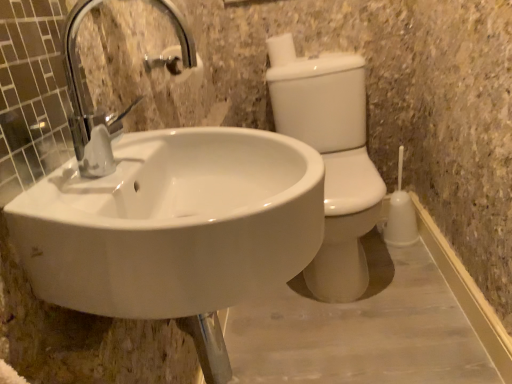
Question: Is white matte toilet paper at upper center in front of or behind white glossy sink at center in the image?

Choices:
 (A) behind
 (B) front

Answer: (A)

Question: From a real-world perspective, is white matte toilet paper at upper center above or below white glossy sink at center?

Choices:
 (A) below
 (B) above

Answer: (B)

Question: Estimate the real-world distances between objects in this image. Which object is farther from the white glossy sink at center?

Choices:
 (A) white matte toilet paper at upper center
 (B) white glossy toilet bowl at right

Answer: (A)

Question: Which object is the closest to the white glossy toilet bowl at right?

Choices:
 (A) white glossy sink at center
 (B) white matte toilet paper at upper center

Answer: (B)